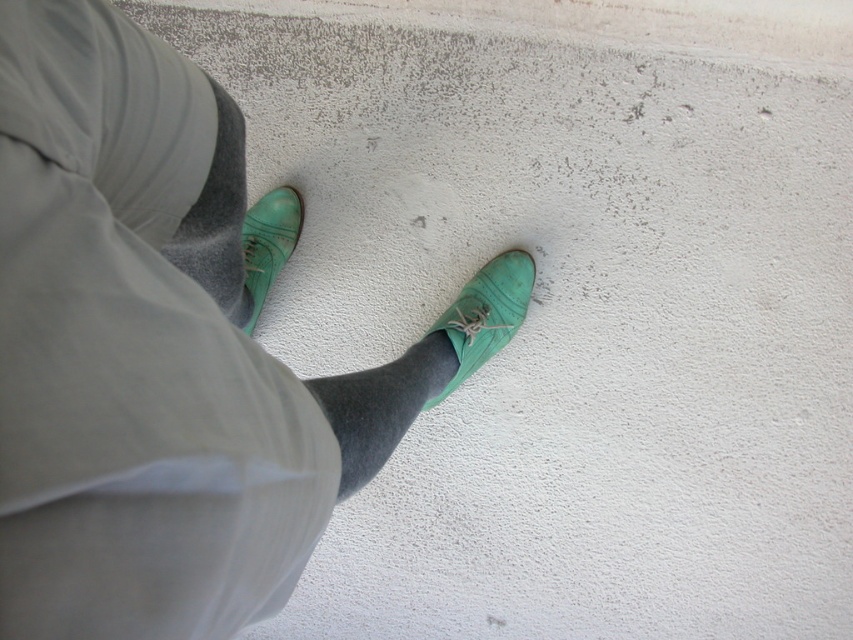
Question: Which object appears closest to the camera in this image?

Choices:
 (A) gray/soft fabric sock at center
 (B) matte green shoe at center
 (C) matte green shoes at center
 (D) gray wool sock at upper left

Answer: (C)

Question: Is gray wool sock at upper left to the right of matte green shoe at center from the viewer's perspective?

Choices:
 (A) yes
 (B) no

Answer: (B)

Question: Among these objects, which one is farthest from the camera?

Choices:
 (A) matte green shoes at center
 (B) matte green shoe at center
 (C) gray wool sock at upper left
 (D) matte green shoe at left

Answer: (D)

Question: Is gray wool sock at upper left further to the viewer compared to matte green shoe at left?

Choices:
 (A) no
 (B) yes

Answer: (A)

Question: Among these points, which one is nearest to the camera?

Choices:
 (A) (329, 465)
 (B) (346, 490)
 (C) (264, 266)
 (D) (231, 195)

Answer: (A)

Question: Is matte green shoes at center in front of matte green shoe at center?

Choices:
 (A) no
 (B) yes

Answer: (B)